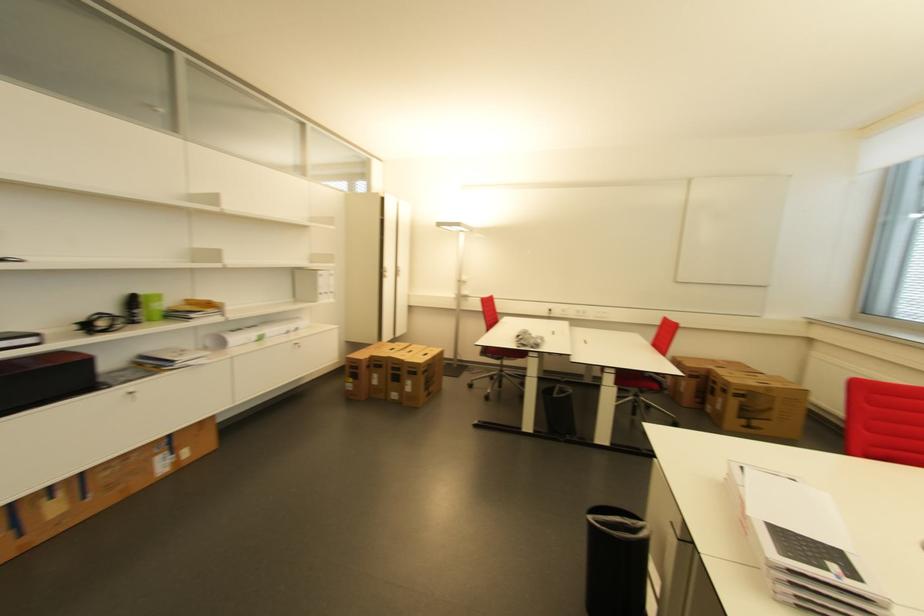
The image size is (924, 616). Find the location of `cardboard box hand-hold`. cardboard box hand-hold is located at coordinates (363, 363).